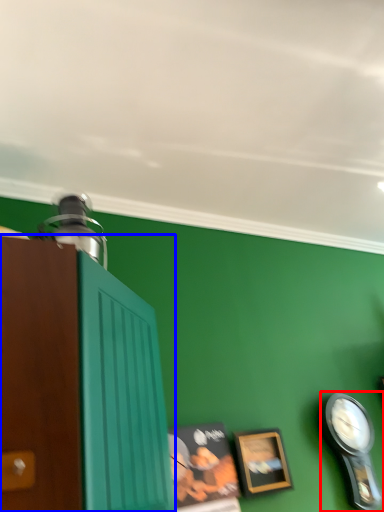
Question: Which of the following is the farthest to the observer, clock (highlighted by a red box) or cabinetry (highlighted by a blue box)?

Choices:
 (A) clock
 (B) cabinetry

Answer: (A)